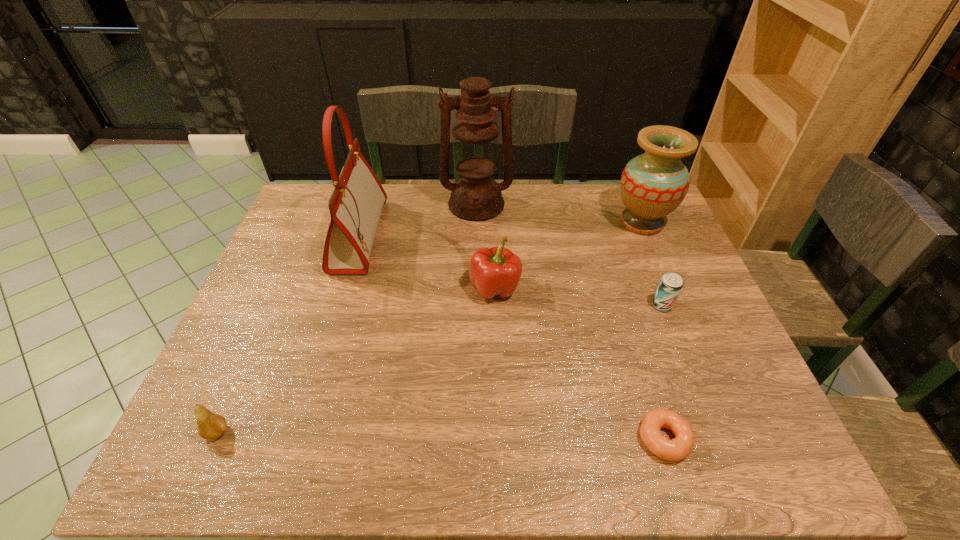
You are a GUI agent. You are given a task and a screenshot of the screen. Output one action in this format:
    pyautogui.click(x=<x>, y=<y>)
    Task: Click on the vase situated at the right edge
    The image size is (960, 540).
    Given the screenshot: What is the action you would take?
    [653, 184]

At what (x,y) coordinates should I click in order to perform the action: click on beer can that is at the right edge. Please return your answer as a coordinate pair (x, y). The height and width of the screenshot is (540, 960). Looking at the image, I should click on (671, 284).

Where is `object present at the near left corner`? The height and width of the screenshot is (540, 960). object present at the near left corner is located at coordinates (210, 425).

Where is `object that is at the far right corner`? The image size is (960, 540). object that is at the far right corner is located at coordinates (653, 184).

I want to click on vacant region at the far edge of the desktop, so click(406, 206).

At what (x,y) coordinates should I click in order to perform the action: click on free space at the near edge of the desktop. Please return your answer as a coordinate pair (x, y). This screenshot has width=960, height=540. Looking at the image, I should click on (413, 463).

The height and width of the screenshot is (540, 960). I want to click on free space at the left edge of the desktop, so click(x=294, y=264).

The width and height of the screenshot is (960, 540). In the image, there is a desktop. Identify the location of free space at the right edge. (698, 302).

Find the location of `vacant space in between the oil lamp and the pepper`. vacant space in between the oil lamp and the pepper is located at coordinates (486, 246).

Where is `free spot between the pear and the fourth tallest object`? The image size is (960, 540). free spot between the pear and the fourth tallest object is located at coordinates (356, 360).